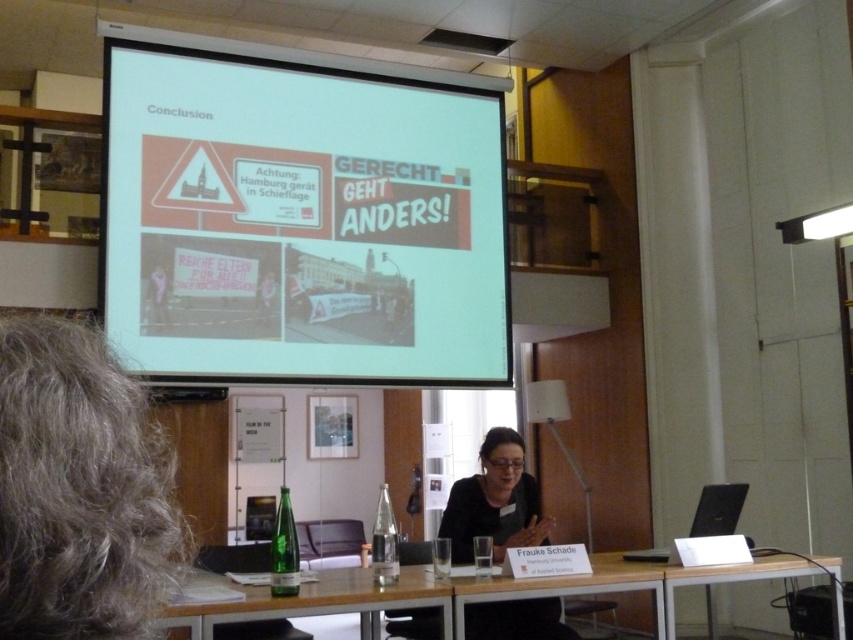
What is the relationship between the white plastic table at lower center and the green glass bottle at lower center in terms of size?

The white plastic table at lower center is larger in size than the green glass bottle at lower center.

You are an attendee at a presentation in a conference room. You need to place a laptop on the white plastic table at lower center. However, the screen of the white glossy projector screen at upper center is blocking your view. Can you move the laptop to a position where you can see both the laptop and the projector screen clearly?

The white plastic table at lower center is behind the white glossy projector screen at upper center, so moving the laptop there would place it behind the screen, blocking your view. To see both, you would need to position the laptop on the table in a way that allows you to look over or around the screen, or move to a different location where both are visible.